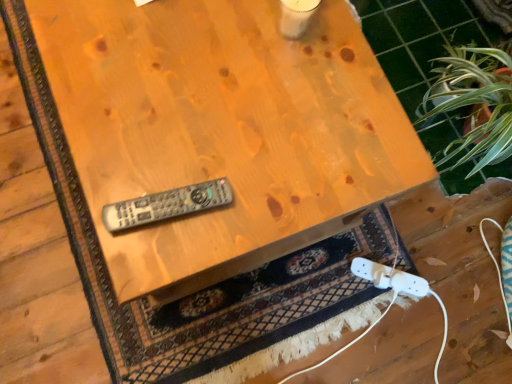
This screenshot has width=512, height=384. I want to click on free space behind white plastic game controller at lower right, so click(x=387, y=242).